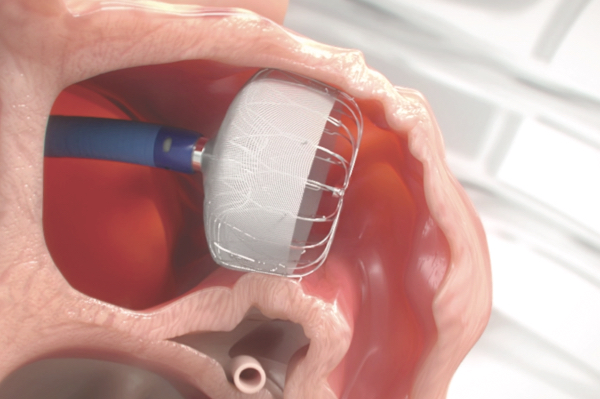
Where is `handle`? The image size is (600, 399). handle is located at coordinates pyautogui.click(x=133, y=151).